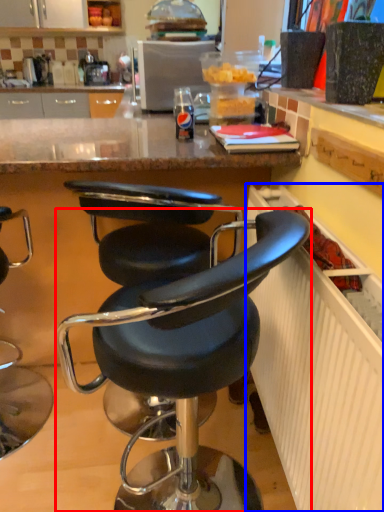
Question: Which point is further to the camera, chair (highlighted by a red box) or radiator (highlighted by a blue box)?

Choices:
 (A) chair
 (B) radiator

Answer: (A)